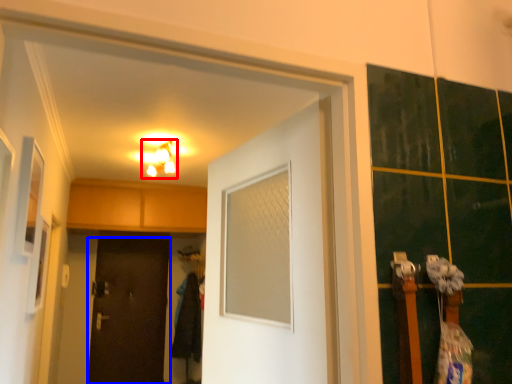
Question: Which object appears farthest to the camera in this image, light fixture (highlighted by a red box) or door (highlighted by a blue box)?

Choices:
 (A) light fixture
 (B) door

Answer: (B)